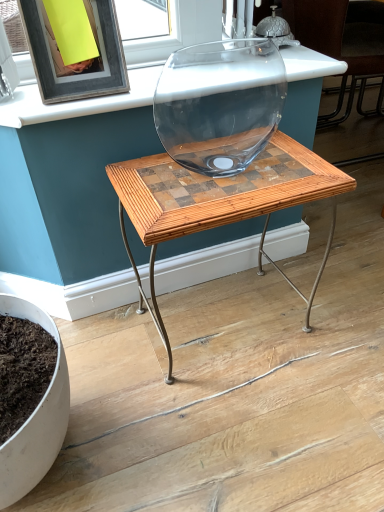
Where is `free spot above transparent glass bowl at upper center (from a real-world perspective)`? free spot above transparent glass bowl at upper center (from a real-world perspective) is located at coordinates (175, 78).